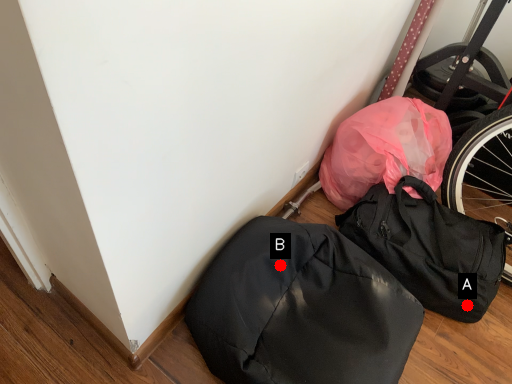
Question: Two points are circled on the image, labeled by A and B beside each circle. Which point is closer to the camera?

Choices:
 (A) A is closer
 (B) B is closer

Answer: (B)